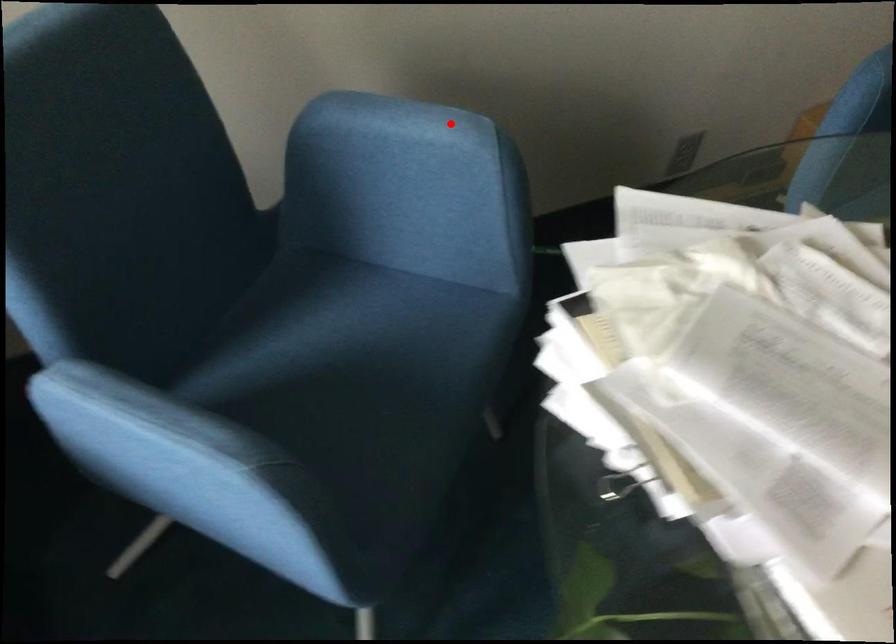
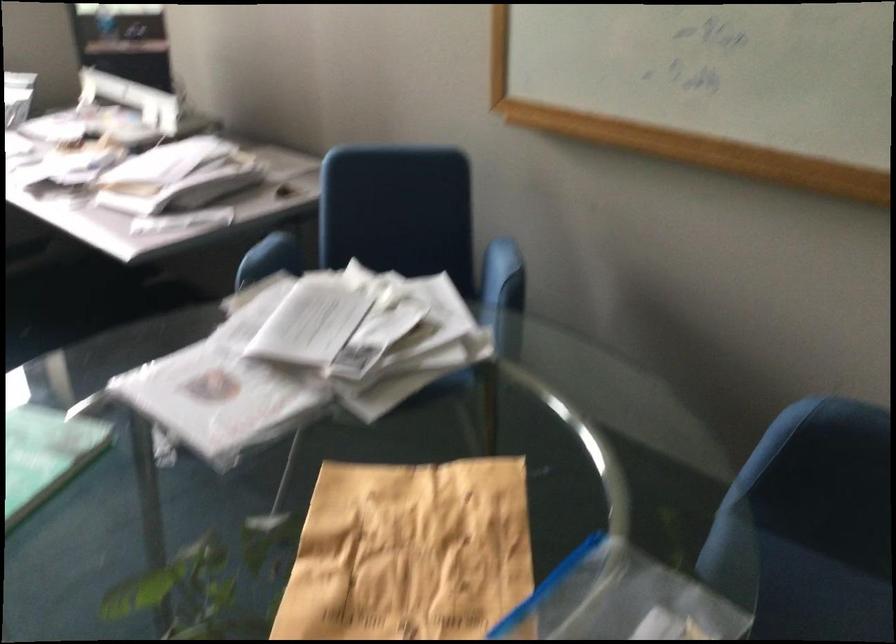
Locate, in the second image, the point that corresponds to the highlighted location in the first image.

(498, 265)